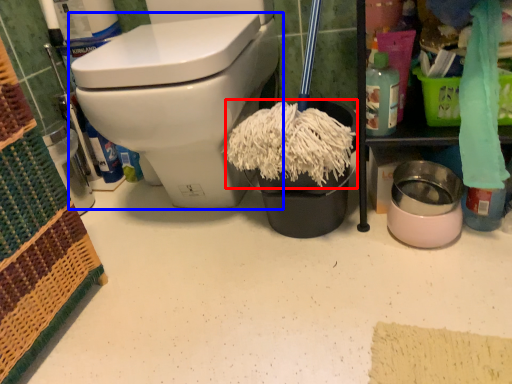
Question: Which object is closer to the camera taking this photo, debris (highlighted by a red box) or toilet (highlighted by a blue box)?

Choices:
 (A) debris
 (B) toilet

Answer: (B)